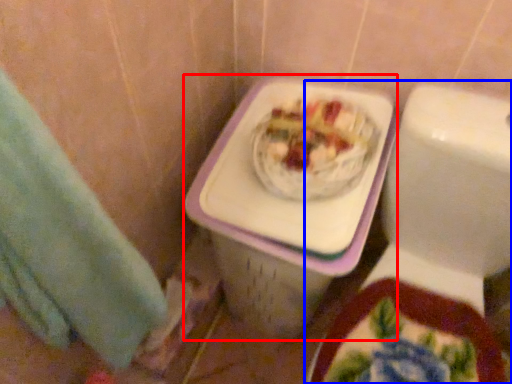
Question: Among these objects, which one is farthest to the camera, porcelain (highlighted by a red box) or toilet (highlighted by a blue box)?

Choices:
 (A) porcelain
 (B) toilet

Answer: (A)